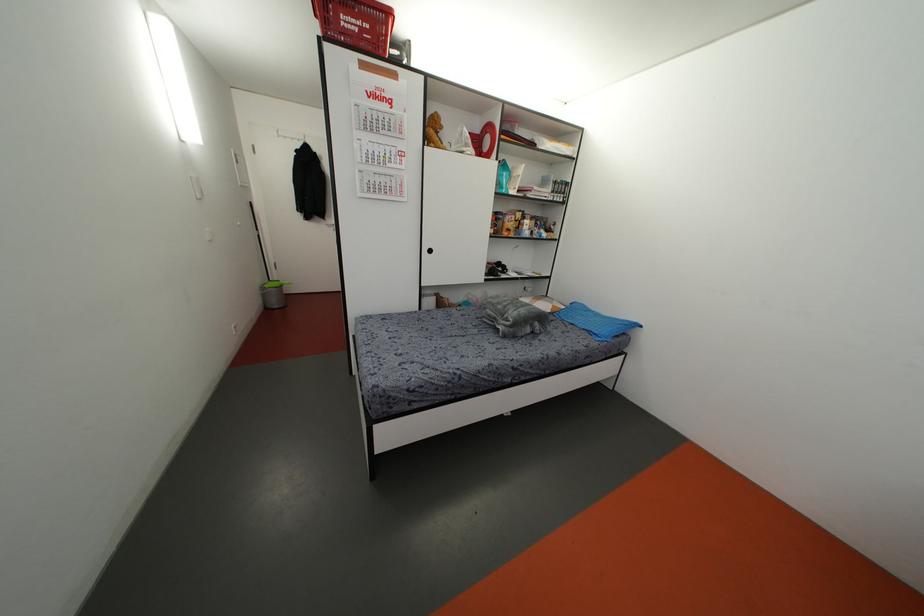
This screenshot has height=616, width=924. Describe the element at coordinates (258, 227) in the screenshot. I see `the mop handle` at that location.